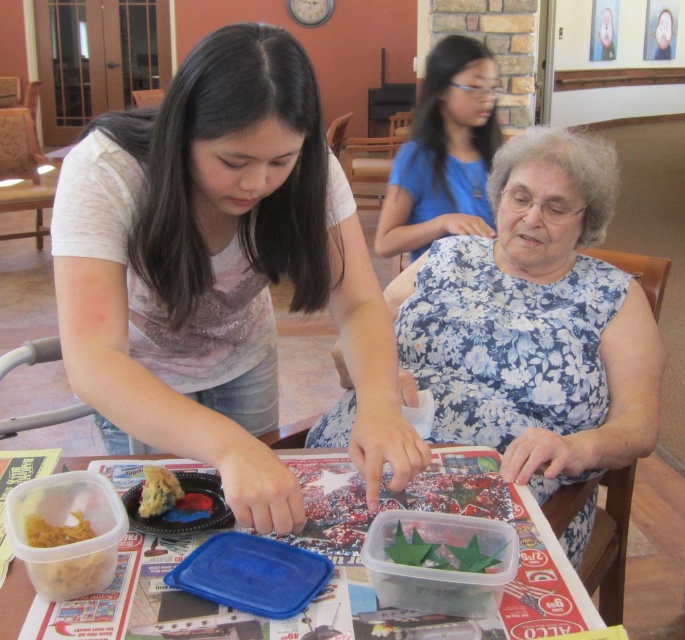
Question: Which object appears farthest from the camera in this image?

Choices:
 (A) clear plastic table at center
 (B) brown crumbly cake at lower left

Answer: (B)

Question: Does clear plastic table at center appear under yellowish matte food at lower left?

Choices:
 (A) yes
 (B) no

Answer: (A)

Question: Is clear plastic table at center positioned before brown crumbly cake at lower left?

Choices:
 (A) no
 (B) yes

Answer: (B)

Question: Considering the relative positions of white floral dress at center and yellowish matte food at lower left in the image provided, where is white floral dress at center located with respect to yellowish matte food at lower left?

Choices:
 (A) above
 (B) below

Answer: (A)

Question: Estimate the real-world distances between objects in this image. Which object is closer to the blue fabric at upper center?

Choices:
 (A) clear plastic table at center
 (B) white floral dress at center
 (C) brown crumbly cake at lower left

Answer: (B)

Question: Which object is positioned farthest from the clear plastic table at center?

Choices:
 (A) white floral dress at center
 (B) yellowish matte food at lower left
 (C) blue fabric at upper center

Answer: (C)